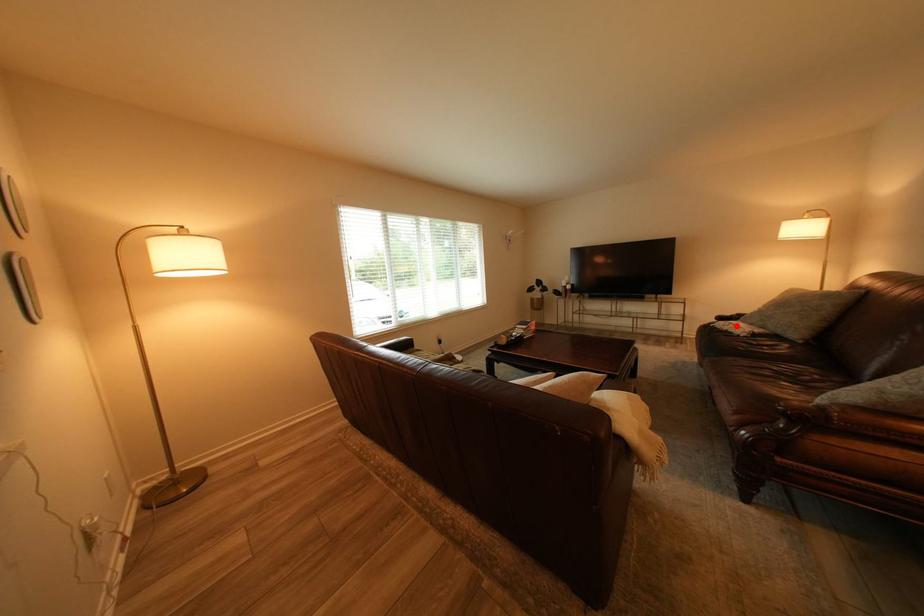
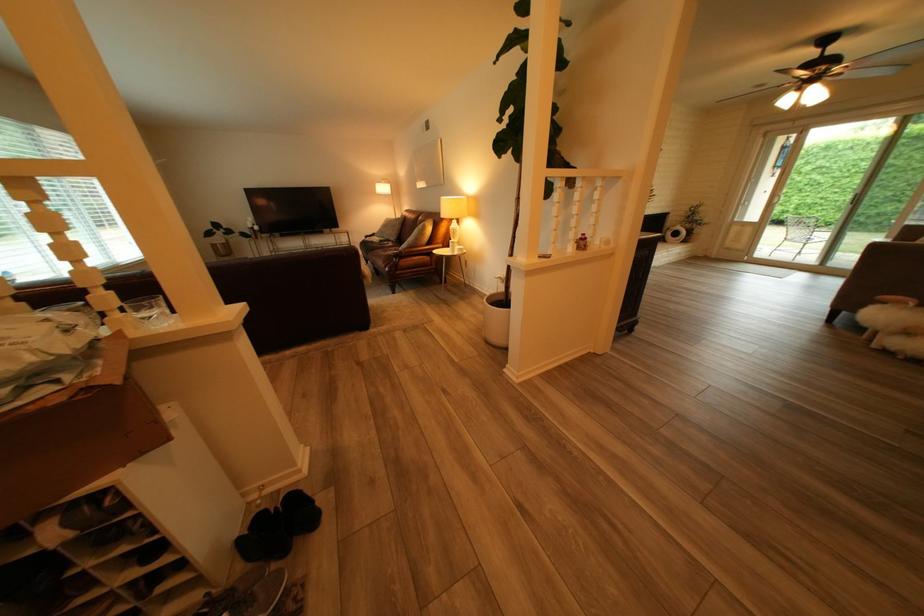
Locate, in the second image, the point that corresponds to the highlighted location in the first image.

(383, 240)